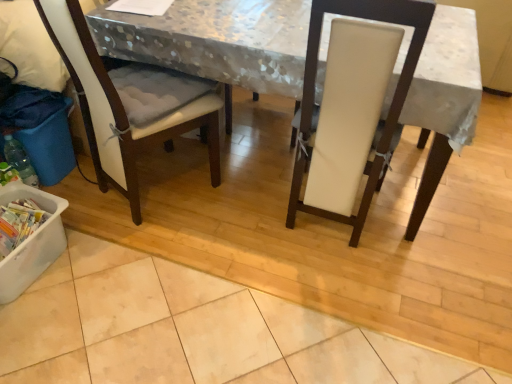
Find the location of a particular element. free space in front of white fabric chair at left, the 1th chair in the left-to-right sequence is located at coordinates (143, 270).